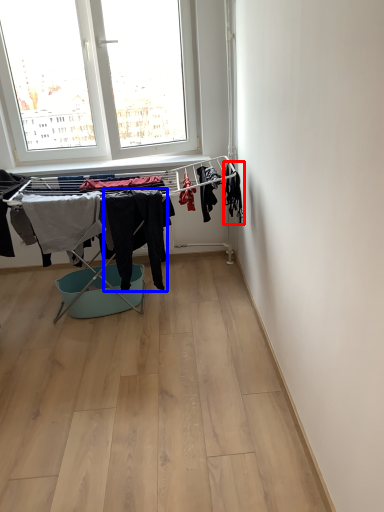
Question: Among these objects, which one is nearest to the camera, clothing (highlighted by a red box) or clothing (highlighted by a blue box)?

Choices:
 (A) clothing
 (B) clothing

Answer: (B)